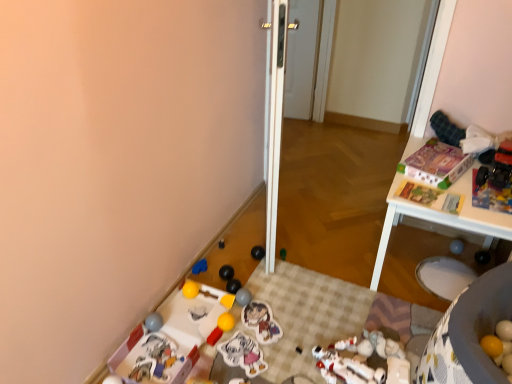
Locate an element on the screen. The width and height of the screenshot is (512, 384). vacant space situated on the left part of plastic toy car at upper right, the 2th toy in the right-to-left sequence is located at coordinates (463, 180).